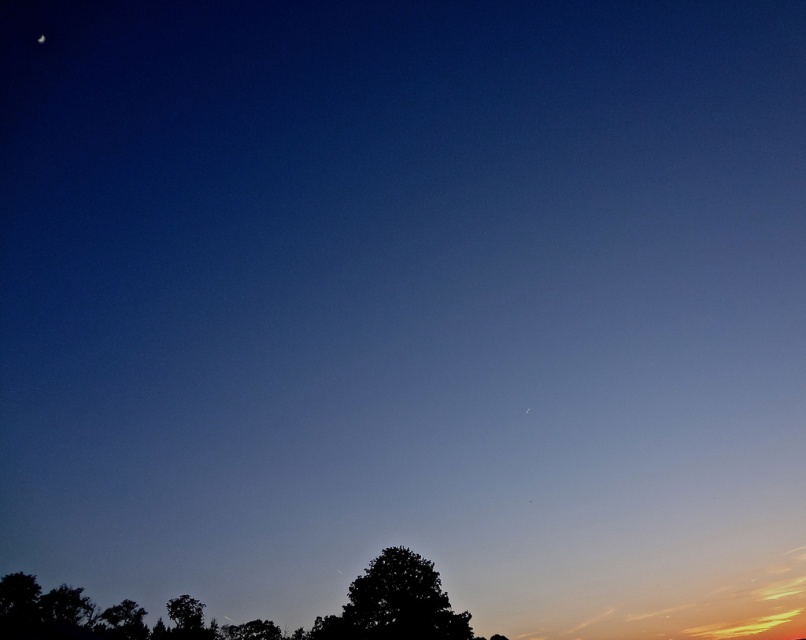
Question: Does dark green leafy tree at lower center appear under white glossy moon at upper left?

Choices:
 (A) no
 (B) yes

Answer: (B)

Question: Which object appears closest to the camera in this image?

Choices:
 (A) white glossy moon at upper left
 (B) dark green leafy tree at lower center

Answer: (B)

Question: Which point is closer to the camera taking this photo?

Choices:
 (A) (39, 42)
 (B) (420, 589)

Answer: (B)

Question: Is dark green leafy tree at lower center thinner than white glossy moon at upper left?

Choices:
 (A) yes
 (B) no

Answer: (B)

Question: Does dark green leafy tree at lower center have a smaller size compared to white glossy moon at upper left?

Choices:
 (A) yes
 (B) no

Answer: (B)